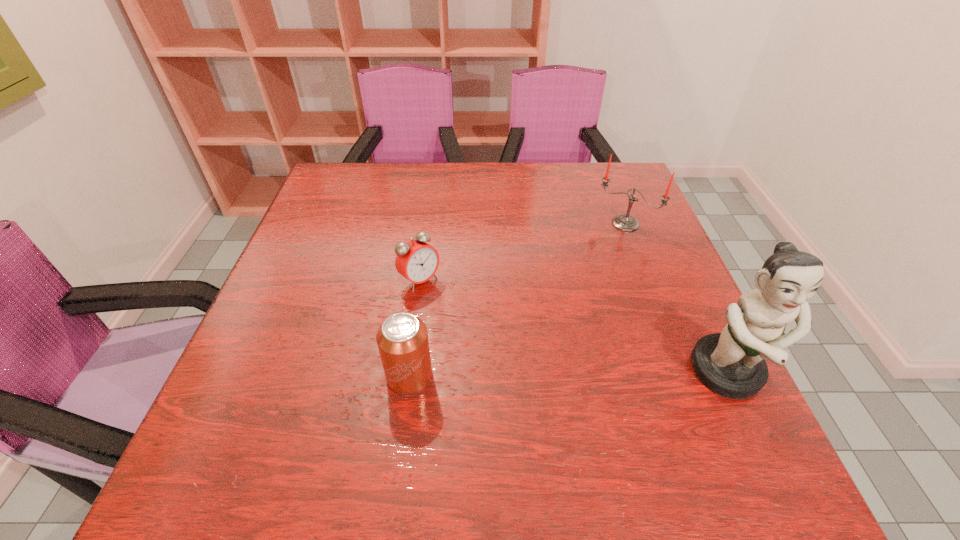
Image resolution: width=960 pixels, height=540 pixels. I want to click on vacant space situated 0.390m on the front-facing side of the shortest object, so click(x=566, y=410).

At what (x,y) coordinates should I click in order to perform the action: click on vacant area located 0.240m on the front-facing side of the shortest object. Please return your answer as a coordinate pair (x, y). The image size is (960, 540). Looking at the image, I should click on (507, 357).

At what (x,y) coordinates should I click in order to perform the action: click on vacant space positioned on the front-facing side of the shortest object. Please return your answer as a coordinate pair (x, y). Looking at the image, I should click on (511, 361).

Find the location of `can that is positioned at the near edge`. can that is positioned at the near edge is located at coordinates (402, 339).

You are a GUI agent. You are given a task and a screenshot of the screen. Output one action in this format:
    pyautogui.click(x=<x>, y=<y>)
    Task: Click on the figurine that is at the near edge
    
    Given the screenshot: What is the action you would take?
    pyautogui.click(x=732, y=364)

At what (x,y) coordinates should I click in order to perform the action: click on figurine that is at the right edge. Please return your answer as a coordinate pair (x, y). The height and width of the screenshot is (540, 960). Looking at the image, I should click on (732, 364).

Locate an element on the screen. The image size is (960, 540). candle that is at the right edge is located at coordinates (624, 222).

Locate an element on the screen. object located at the near right corner is located at coordinates (732, 364).

The height and width of the screenshot is (540, 960). What are the coordinates of `vacant region at the far edge of the desktop` in the screenshot? It's located at (398, 198).

What are the coordinates of `vacant space at the near edge of the desktop` in the screenshot? It's located at click(497, 396).